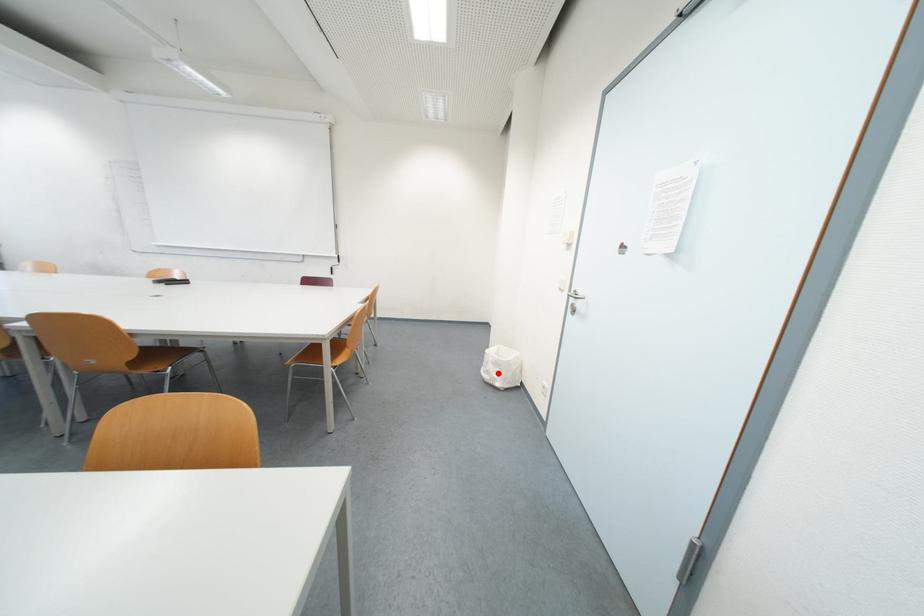
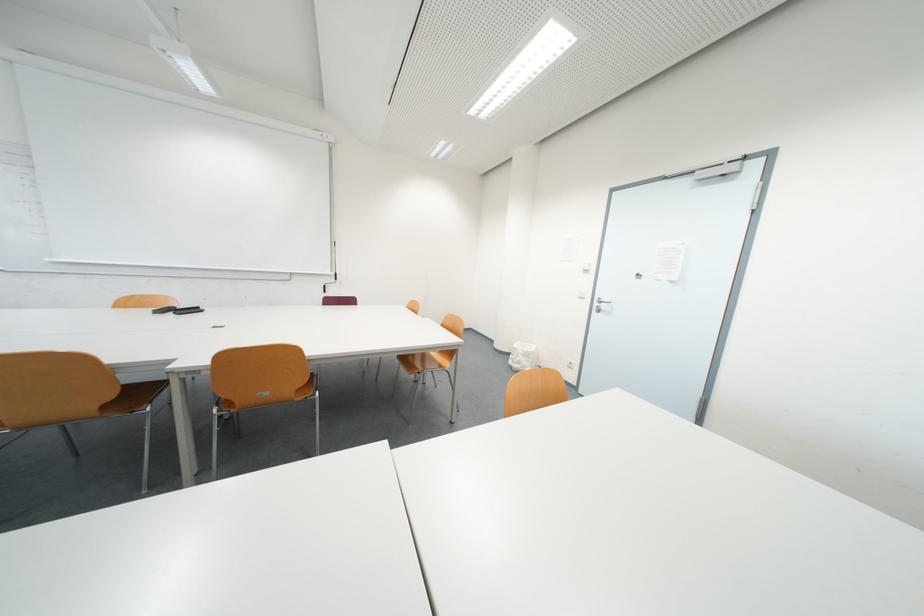
Question: I am providing you with two images of the same scene from different viewpoints. In image1, a red point is highlighted. Considering the same 3D point in image2, which of the following is correct?

Choices:
 (A) It is closer
 (B) It is farther

Answer: (A)